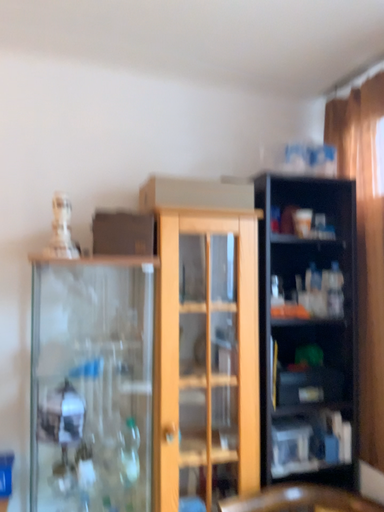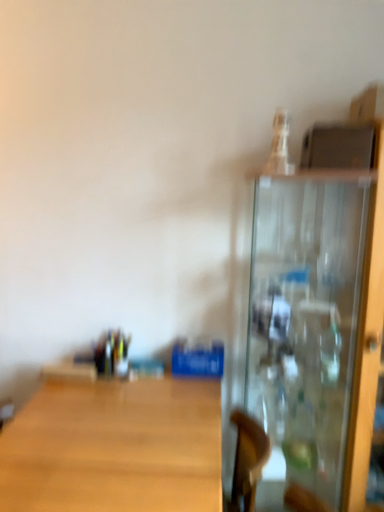
Question: Which way did the camera rotate in the video?

Choices:
 (A) rotated right
 (B) rotated left

Answer: (B)